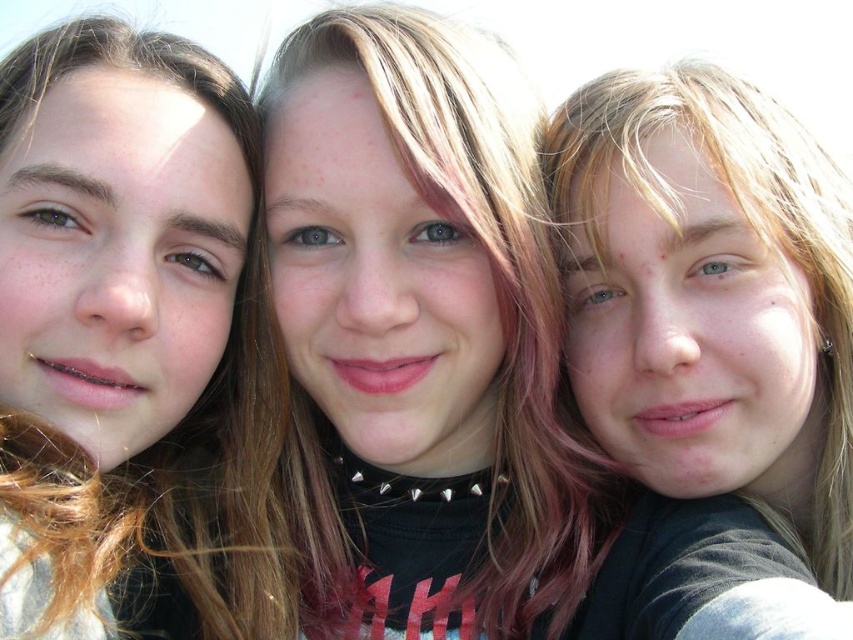
Is matte black shirt at center smaller than matte black hair at center?

No, matte black shirt at center is not smaller than matte black hair at center.

Can you confirm if matte black shirt at center is positioned above matte black hair at center?

Incorrect, matte black shirt at center is not positioned above matte black hair at center.

Where is `matte black shirt at center`? matte black shirt at center is located at coordinates (421, 321).

The height and width of the screenshot is (640, 853). Find the location of `matte black shirt at center`. matte black shirt at center is located at coordinates (421, 321).

In order to click on matte black shirt at center in this screenshot , I will do `click(421, 321)`.

Who is higher up, matte black shirt at center or brown hair at left?

matte black shirt at center

The image size is (853, 640). What do you see at coordinates (421, 321) in the screenshot? I see `matte black shirt at center` at bounding box center [421, 321].

Locate an element on the screen. matte black shirt at center is located at coordinates (421, 321).

Does brown hair at left have a larger size compared to matte black hair at center?

No.

Is brown hair at left shorter than matte black hair at center?

Indeed, brown hair at left has a lesser height compared to matte black hair at center.

You are a GUI agent. You are given a task and a screenshot of the screen. Output one action in this format:
    pyautogui.click(x=<x>, y=<y>)
    Task: Click on the brown hair at left
    
    Given the screenshot: What is the action you would take?
    pyautogui.click(x=122, y=337)